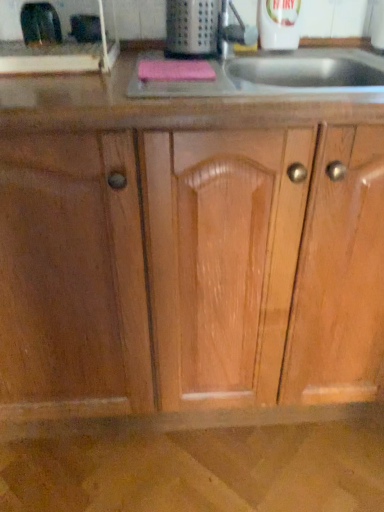
At what (x,y) coordinates should I click in order to perform the action: click on black rubber gloves at upper left, the 3th appliance viewed from the right. Please return your answer as a coordinate pair (x, y). Looking at the image, I should click on click(40, 24).

In order to click on appliance in front of the black rubber gloves at upper left, the 3th appliance viewed from the right in this screenshot , I will do `click(191, 28)`.

Is black rubber gloves at upper left, the 3th appliance viewed from the right, turned away from metallic grater at upper center, acting as the 1th appliance starting from the right?

No, black rubber gloves at upper left, the 3th appliance viewed from the right, is not facing the opposite direction of metallic grater at upper center, acting as the 1th appliance starting from the right.

Which is correct: black rubber gloves at upper left, the 3th appliance viewed from the right, is inside metallic grater at upper center, acting as the 1th appliance starting from the right, or outside of it?

black rubber gloves at upper left, the 3th appliance viewed from the right, is not enclosed by metallic grater at upper center, acting as the 1th appliance starting from the right.

Is black rubber gloves at upper left, the first appliance viewed from the left, placed right next to metallic grater at upper center, which appears as the third appliance when viewed from the left?

No.

Considering the relative positions of metallic silver toaster at upper left, the second appliance from the left, and metallic grater at upper center, which appears as the third appliance when viewed from the left, in the image provided, is metallic silver toaster at upper left, the second appliance from the left, to the left of metallic grater at upper center, which appears as the third appliance when viewed from the left, from the viewer's perspective?

Correct, you'll find metallic silver toaster at upper left, the second appliance from the left, to the left of metallic grater at upper center, which appears as the third appliance when viewed from the left.

The width and height of the screenshot is (384, 512). Identify the location of the 1st appliance to the left of the metallic grater at upper center, which appears as the third appliance when viewed from the left, starting your count from the anchor. (85, 28).

Is metallic silver toaster at upper left, which appears as the 2th appliance when viewed from the right, inside or outside of metallic grater at upper center, acting as the 1th appliance starting from the right?

metallic silver toaster at upper left, which appears as the 2th appliance when viewed from the right, lies outside metallic grater at upper center, acting as the 1th appliance starting from the right.

Could you tell me if pink fabric sponge at upper center is facing metallic grater at upper center, which appears as the third appliance when viewed from the left?

No, pink fabric sponge at upper center is not turned towards metallic grater at upper center, which appears as the third appliance when viewed from the left.

Would you say pink fabric sponge at upper center is a long distance from metallic grater at upper center, which appears as the third appliance when viewed from the left?

No, pink fabric sponge at upper center is not far from metallic grater at upper center, which appears as the third appliance when viewed from the left.

Who is smaller, pink fabric sponge at upper center or metallic grater at upper center, which appears as the third appliance when viewed from the left?

pink fabric sponge at upper center.

Consider the image. Are black rubber gloves at upper left, the first appliance viewed from the left, and metallic silver toaster at upper left, the second appliance from the left, located far from each other?

No, black rubber gloves at upper left, the first appliance viewed from the left, is not far from metallic silver toaster at upper left, the second appliance from the left.

Between black rubber gloves at upper left, the first appliance viewed from the left, and metallic silver toaster at upper left, the second appliance from the left, which one has smaller size?

With smaller size is black rubber gloves at upper left, the first appliance viewed from the left.

Considering the positions of points (49, 8) and (83, 16), is point (49, 8) closer to camera compared to point (83, 16)?

Yes, point (49, 8) is in front of point (83, 16).

How far apart are black rubber gloves at upper left, the first appliance viewed from the left, and metallic silver toaster at upper left, which appears as the 2th appliance when viewed from the right?

A distance of 2.56 inches exists between black rubber gloves at upper left, the first appliance viewed from the left, and metallic silver toaster at upper left, which appears as the 2th appliance when viewed from the right.

From the image's perspective, does metallic silver toaster at upper left, the second appliance from the left, appear higher than black rubber gloves at upper left, the first appliance viewed from the left?

Correct, metallic silver toaster at upper left, the second appliance from the left, appears higher than black rubber gloves at upper left, the first appliance viewed from the left, in the image.

From a real-world perspective, who is located higher, metallic silver toaster at upper left, the second appliance from the left, or black rubber gloves at upper left, the 3th appliance viewed from the right?

From a 3D spatial view, black rubber gloves at upper left, the 3th appliance viewed from the right, is above.

Considering the sizes of objects metallic silver toaster at upper left, which appears as the 2th appliance when viewed from the right, and black rubber gloves at upper left, the first appliance viewed from the left, in the image provided, who is smaller, metallic silver toaster at upper left, which appears as the 2th appliance when viewed from the right, or black rubber gloves at upper left, the first appliance viewed from the left,?

black rubber gloves at upper left, the first appliance viewed from the left.

Does metallic silver toaster at upper left, the second appliance from the left, lie in front of black rubber gloves at upper left, the first appliance viewed from the left?

No, it is behind black rubber gloves at upper left, the first appliance viewed from the left.

Considering their positions, is metallic grater at upper center, acting as the 1th appliance starting from the right, located in front of or behind pink fabric sponge at upper center?

metallic grater at upper center, acting as the 1th appliance starting from the right, is behind pink fabric sponge at upper center.

Consider the image. Is pink fabric sponge at upper center at the back of metallic grater at upper center, which appears as the third appliance when viewed from the left?

No, metallic grater at upper center, which appears as the third appliance when viewed from the left, is not facing the opposite direction of pink fabric sponge at upper center.

The width and height of the screenshot is (384, 512). Identify the location of appliance that is the 1st one when counting backward from the pink fabric sponge at upper center. (191, 28).

From the image's perspective, count 2nd appliances downward from the metallic grater at upper center, acting as the 1th appliance starting from the right, and point to it. Please provide its 2D coordinates.

[(40, 24)]

From the picture: From the image's perspective, is metallic grater at upper center, which appears as the third appliance when viewed from the left, above or below black rubber gloves at upper left, the first appliance viewed from the left?

From the image's perspective, metallic grater at upper center, which appears as the third appliance when viewed from the left, appears above black rubber gloves at upper left, the first appliance viewed from the left.

Between metallic grater at upper center, which appears as the third appliance when viewed from the left, and black rubber gloves at upper left, the 3th appliance viewed from the right, which one has larger size?

metallic grater at upper center, which appears as the third appliance when viewed from the left, is bigger.

Which is in front, metallic grater at upper center, acting as the 1th appliance starting from the right, or black rubber gloves at upper left, the first appliance viewed from the left?

metallic grater at upper center, acting as the 1th appliance starting from the right, is closer to the camera.

The image size is (384, 512). Identify the location of the 1st appliance behind the metallic grater at upper center, acting as the 1th appliance starting from the right. (40, 24).

The width and height of the screenshot is (384, 512). In order to click on the 2nd appliance directly beneath the metallic grater at upper center, acting as the 1th appliance starting from the right (from a real-world perspective) in this screenshot , I will do `click(85, 28)`.

Considering their positions, is metallic grater at upper center, which appears as the third appliance when viewed from the left, positioned further to pink fabric sponge at upper center than black rubber gloves at upper left, the 3th appliance viewed from the right?

black rubber gloves at upper left, the 3th appliance viewed from the right, is further to pink fabric sponge at upper center.

When comparing their distances from metallic grater at upper center, acting as the 1th appliance starting from the right, does metallic silver toaster at upper left, the second appliance from the left, or pink fabric sponge at upper center seem closer?

Among the two, pink fabric sponge at upper center is located nearer to metallic grater at upper center, acting as the 1th appliance starting from the right.

Looking at the image, which one is located closer to black rubber gloves at upper left, the first appliance viewed from the left, metallic silver toaster at upper left, which appears as the 2th appliance when viewed from the right, or metallic grater at upper center, acting as the 1th appliance starting from the right?

Among the two, metallic silver toaster at upper left, which appears as the 2th appliance when viewed from the right, is located nearer to black rubber gloves at upper left, the first appliance viewed from the left.

Based on their spatial positions, is pink fabric sponge at upper center or black rubber gloves at upper left, the first appliance viewed from the left, further from metallic grater at upper center, which appears as the third appliance when viewed from the left?

The object further to metallic grater at upper center, which appears as the third appliance when viewed from the left, is black rubber gloves at upper left, the first appliance viewed from the left.

From the image, which object appears to be nearer to metallic grater at upper center, acting as the 1th appliance starting from the right, black rubber gloves at upper left, the first appliance viewed from the left, or metallic silver toaster at upper left, which appears as the 2th appliance when viewed from the right?

metallic silver toaster at upper left, which appears as the 2th appliance when viewed from the right, is closer to metallic grater at upper center, acting as the 1th appliance starting from the right.

Based on their spatial positions, is black rubber gloves at upper left, the first appliance viewed from the left, or pink fabric sponge at upper center further from metallic silver toaster at upper left, which appears as the 2th appliance when viewed from the right?

pink fabric sponge at upper center is further to metallic silver toaster at upper left, which appears as the 2th appliance when viewed from the right.

From the picture: Which object lies nearer to the anchor point pink fabric sponge at upper center, metallic silver toaster at upper left, the second appliance from the left, or black rubber gloves at upper left, the first appliance viewed from the left?

The object closer to pink fabric sponge at upper center is metallic silver toaster at upper left, the second appliance from the left.

Based on their spatial positions, is metallic grater at upper center, acting as the 1th appliance starting from the right, or pink fabric sponge at upper center closer to black rubber gloves at upper left, the 3th appliance viewed from the right?

Among the two, pink fabric sponge at upper center is located nearer to black rubber gloves at upper left, the 3th appliance viewed from the right.

In order to click on appliance between black rubber gloves at upper left, the first appliance viewed from the left, and metallic grater at upper center, which appears as the third appliance when viewed from the left, in the horizontal direction in this screenshot , I will do `click(85, 28)`.

Where is `soap located between black rubber gloves at upper left, the 3th appliance viewed from the right, and metallic grater at upper center, which appears as the third appliance when viewed from the left, in the left-right direction`? soap located between black rubber gloves at upper left, the 3th appliance viewed from the right, and metallic grater at upper center, which appears as the third appliance when viewed from the left, in the left-right direction is located at coordinates (175, 70).

Locate an element on the screen. soap between metallic silver toaster at upper left, the second appliance from the left, and metallic grater at upper center, which appears as the third appliance when viewed from the left, in the horizontal direction is located at coordinates (175, 70).

Identify the location of appliance located between black rubber gloves at upper left, the 3th appliance viewed from the right, and pink fabric sponge at upper center in the left-right direction. (85, 28).